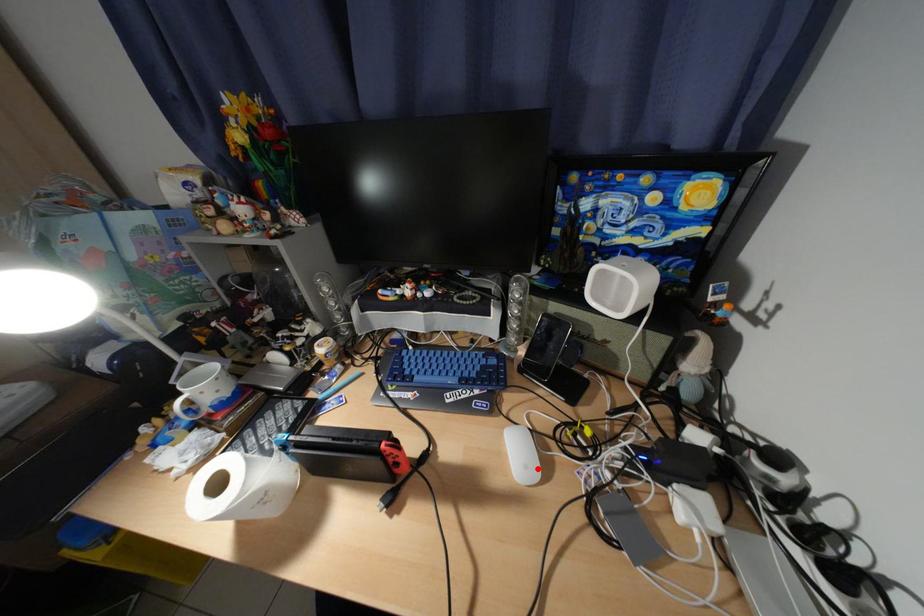
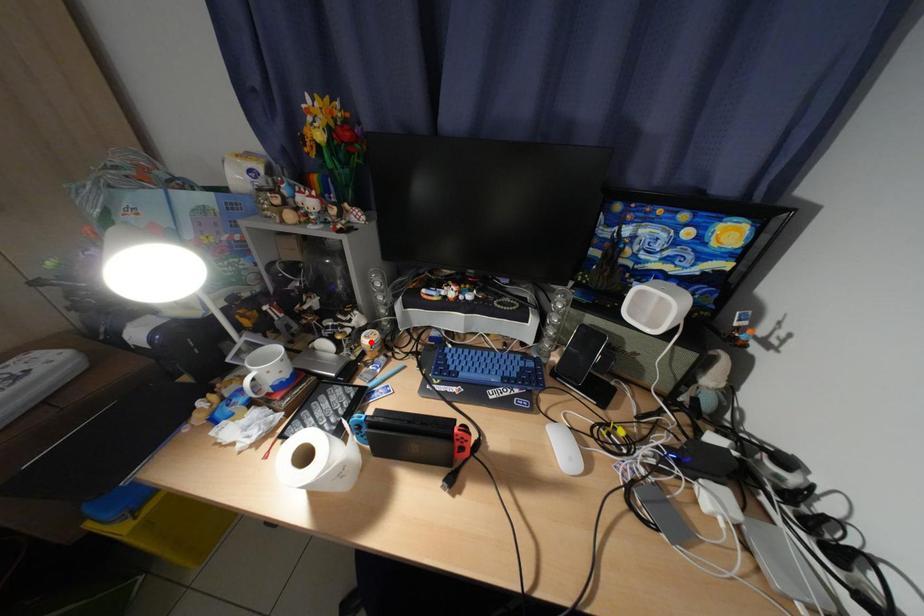
Looking at this image, I am providing you with two images of the same scene from different viewpoints. A red point is marked on the first image and another point is marked on the second image. Is the red point in image1 aligned with the point shown in image2?

No